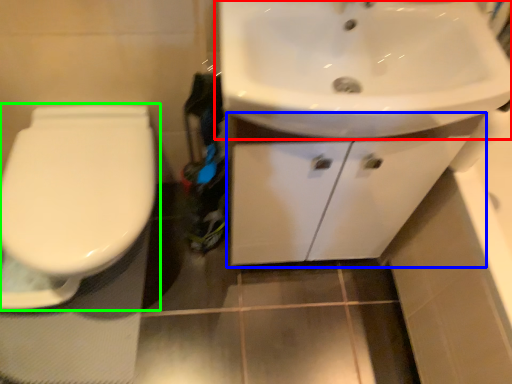
Question: Which object is positioned farthest from sink (highlighted by a red box)? Select from bathroom cabinet (highlighted by a blue box) and toilet (highlighted by a green box).

Choices:
 (A) bathroom cabinet
 (B) toilet

Answer: (B)